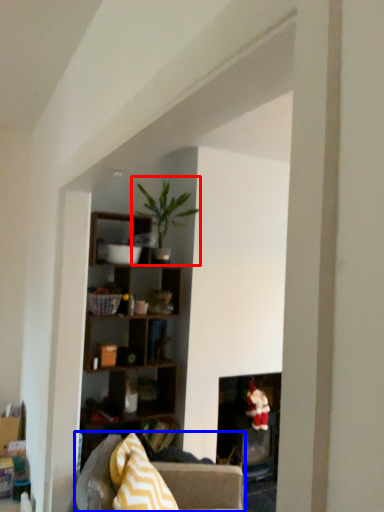
Question: Which point is closer to the camera, houseplant (highlighted by a red box) or studio couch (highlighted by a blue box)?

Choices:
 (A) houseplant
 (B) studio couch

Answer: (B)